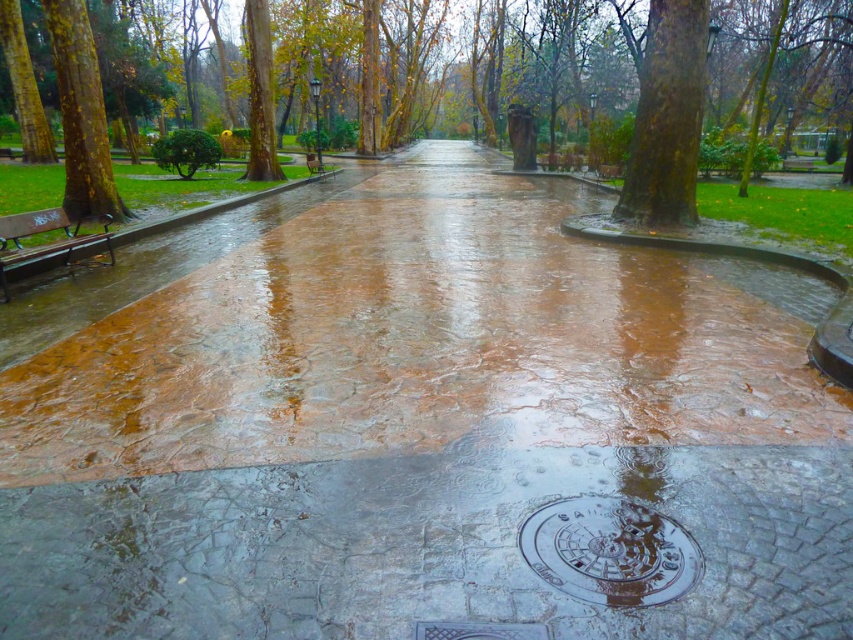
You are a park visitor sitting on the wooden bench at left and want to look up at the green rough bark tree at upper right. Is the tree positioned above the bench?

The green rough bark tree at upper right is located above the wooden bench at left, so yes, the tree is positioned above the bench.